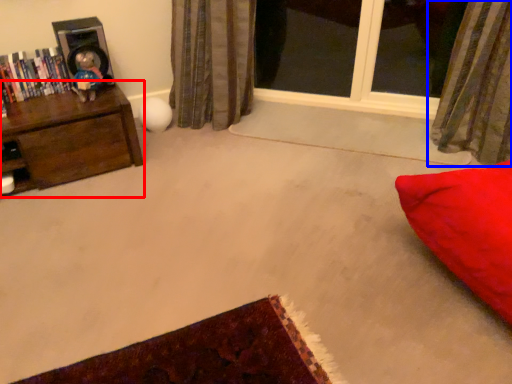
Question: Which object is closer to the camera taking this photo, furniture (highlighted by a red box) or curtain (highlighted by a blue box)?

Choices:
 (A) furniture
 (B) curtain

Answer: (B)